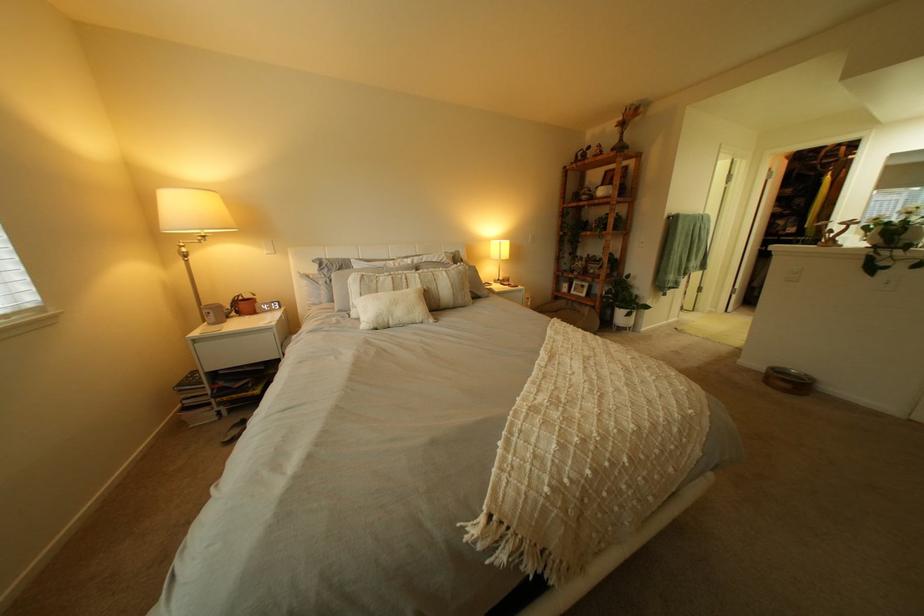
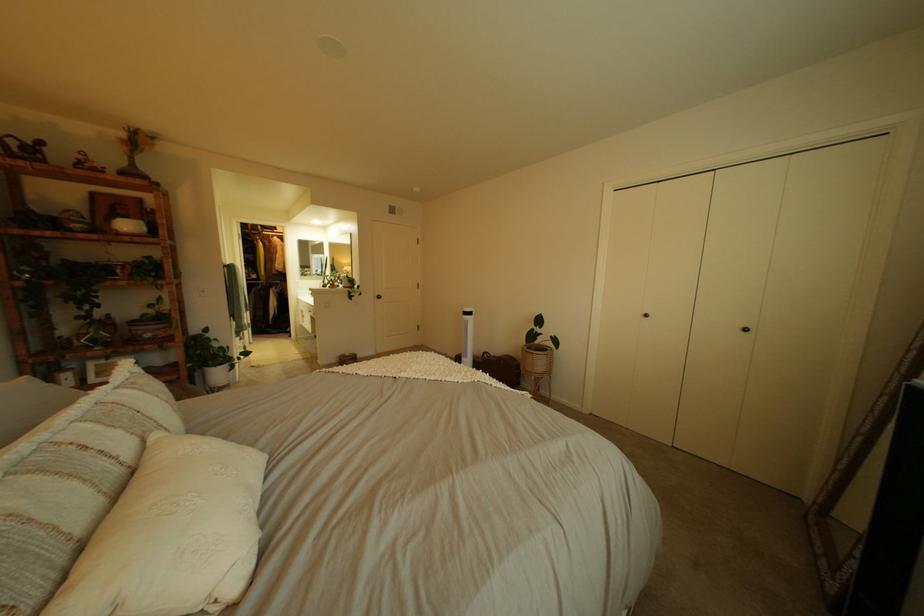
Where in the second image is the point corresponding to point 434,283 from the first image?

(134, 434)